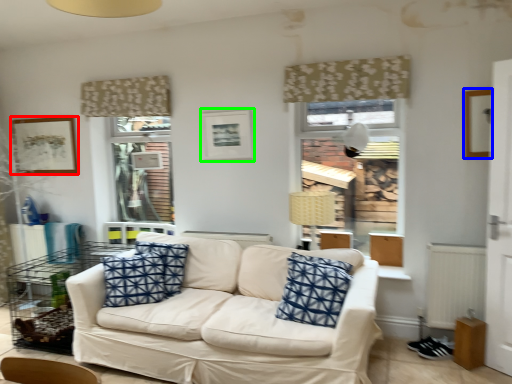
Question: Which object is the closest to the picture frame (highlighted by a red box)? Choose among these: picture frame (highlighted by a blue box) or picture frame (highlighted by a green box).

Choices:
 (A) picture frame
 (B) picture frame

Answer: (B)